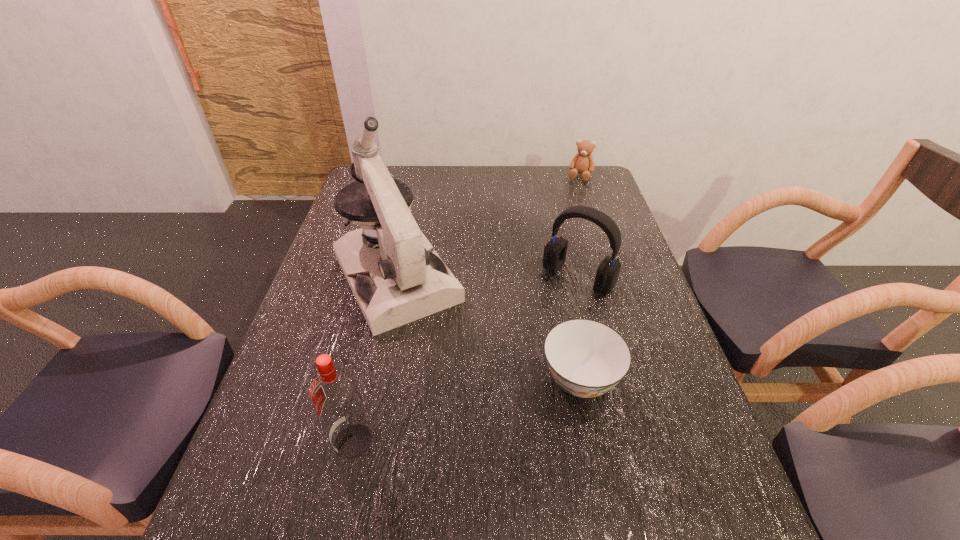
I want to click on vacant space located 0.130m at the eyepiece of the tallest object, so click(445, 366).

The height and width of the screenshot is (540, 960). What are the coordinates of `object at the far edge` in the screenshot? It's located at (583, 163).

The height and width of the screenshot is (540, 960). In order to click on object present at the near edge in this screenshot , I will do `click(334, 393)`.

Image resolution: width=960 pixels, height=540 pixels. I want to click on object that is at the left edge, so click(403, 280).

Where is `soup bowl at the right edge`? soup bowl at the right edge is located at coordinates (586, 358).

This screenshot has height=540, width=960. Find the location of `headset that is at the right edge`. headset that is at the right edge is located at coordinates (554, 256).

Image resolution: width=960 pixels, height=540 pixels. In order to click on teddy bear present at the right edge in this screenshot , I will do `click(583, 163)`.

Image resolution: width=960 pixels, height=540 pixels. In order to click on object located in the far right corner section of the desktop in this screenshot , I will do `click(583, 163)`.

I want to click on free space at the far edge, so click(x=536, y=179).

Locate an element on the screen. This screenshot has height=540, width=960. vacant space at the near edge of the desktop is located at coordinates tap(554, 450).